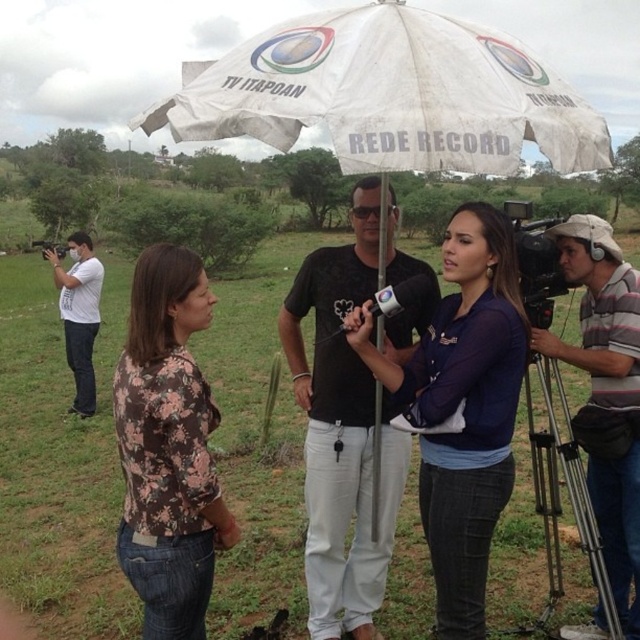
You are a photographer standing at the camera position. You want to capture a photo of the white fabric umbrella at center without including the man in the center who is wearing a black T shirt with a graphic. Is it possible to do so by moving closer or further away from the umbrella?

The white fabric umbrella at center is 6.25 feet away from the camera. Moving closer or further away would not remove the man in the center from the frame, as the distance alone does not change the relative positions of objects in the scene. To exclude him, you would need to adjust the camera angle or position sideways, not just move forward or backward.

You are a camera operator who needs to choose a camera that is easier to hold for long periods. Which camera should you pick between the black plastic video camera at right and the black plastic video camera at left?

The black plastic video camera at right is thinner than the black plastic video camera at left, so it is easier to hold for long periods.